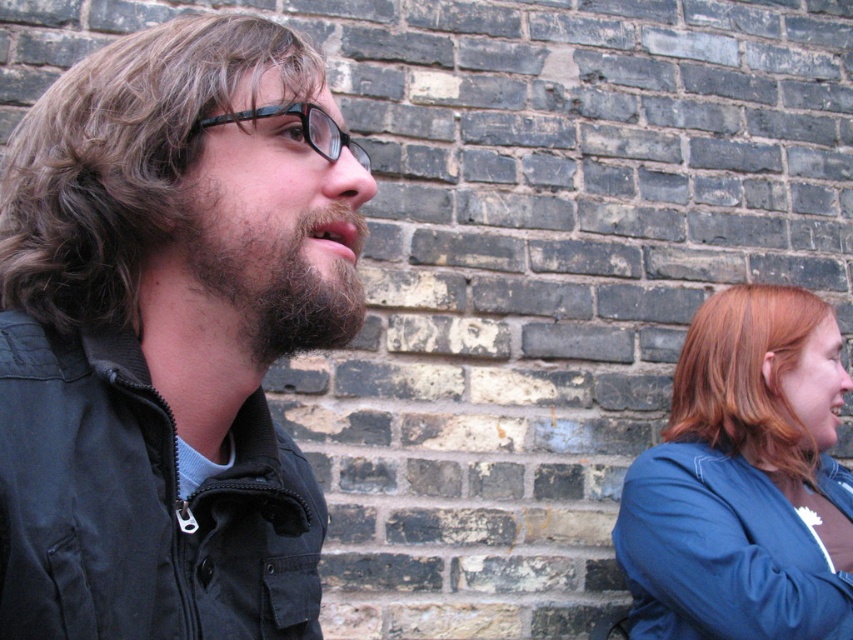
Between brown curly hair at left and blonde hair at right, which one appears on the right side from the viewer's perspective?

Positioned to the right is blonde hair at right.

Can you confirm if brown curly hair at left is positioned above blonde hair at right?

Indeed, brown curly hair at left is positioned over blonde hair at right.

Is point (172, 236) closer to viewer compared to point (759, 456)?

Yes, point (172, 236) is in front of point (759, 456).

Locate an element on the screen. brown curly hair at left is located at coordinates (125, 161).

In the scene shown: Between matte black jacket at left and black cotton jacket at left, which one is positioned higher?

matte black jacket at left is above.

Between point (36, 109) and point (311, 524), which one is positioned behind?

Positioned behind is point (311, 524).

Is point (183, 632) behind point (228, 550)?

No, (183, 632) is in front of (228, 550).

The height and width of the screenshot is (640, 853). In order to click on matte black jacket at left in this screenshot , I will do `click(169, 333)`.

Is matte black jacket at left above dark brown fuzzy beard at left?

Incorrect, matte black jacket at left is not positioned above dark brown fuzzy beard at left.

From the picture: Who is shorter, matte black jacket at left or dark brown fuzzy beard at left?

dark brown fuzzy beard at left

The height and width of the screenshot is (640, 853). I want to click on matte black jacket at left, so click(169, 333).